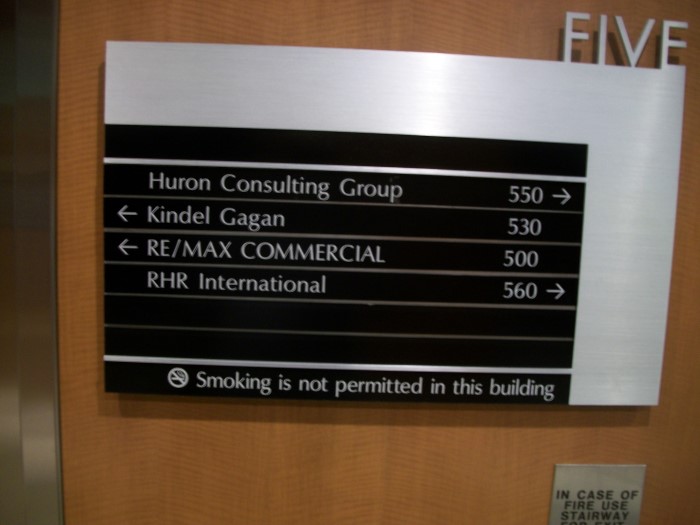
I want to click on placard, so click(617, 277), click(619, 474).